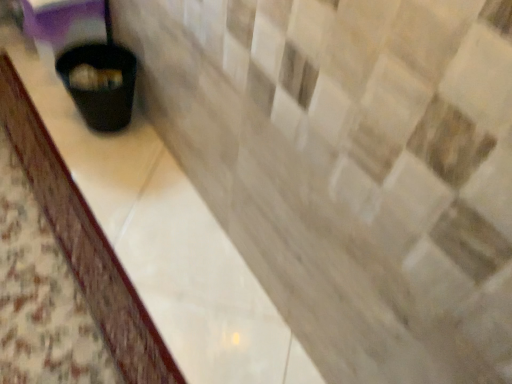
Question: Considering their positions, is black plastic trash can at lower left located in front of or behind black plastic waste container at lower left?

Choices:
 (A) front
 (B) behind

Answer: (A)

Question: Visually, is black plastic trash can at lower left positioned to the left or to the right of black plastic waste container at lower left?

Choices:
 (A) left
 (B) right

Answer: (A)

Question: From a real-world perspective, relative to black plastic waste container at lower left, is black plastic trash can at lower left vertically above or below?

Choices:
 (A) above
 (B) below

Answer: (B)

Question: In terms of height, does black plastic waste container at lower left look taller or shorter compared to black plastic trash can at lower left?

Choices:
 (A) tall
 (B) short

Answer: (A)

Question: In the image, is black plastic waste container at lower left on the left side or the right side of black plastic trash can at lower left?

Choices:
 (A) right
 (B) left

Answer: (A)

Question: Relative to black plastic trash can at lower left, is black plastic waste container at lower left in front or behind?

Choices:
 (A) behind
 (B) front

Answer: (A)

Question: Is point (84, 114) positioned closer to the camera than point (165, 382)?

Choices:
 (A) closer
 (B) farther

Answer: (B)